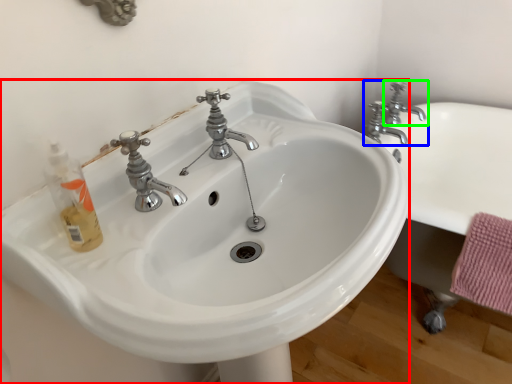
Question: Based on their relative distances, which object is farther from sink (highlighted by a red box)? Choose from tap (highlighted by a blue box) and tap (highlighted by a green box).

Choices:
 (A) tap
 (B) tap

Answer: (B)